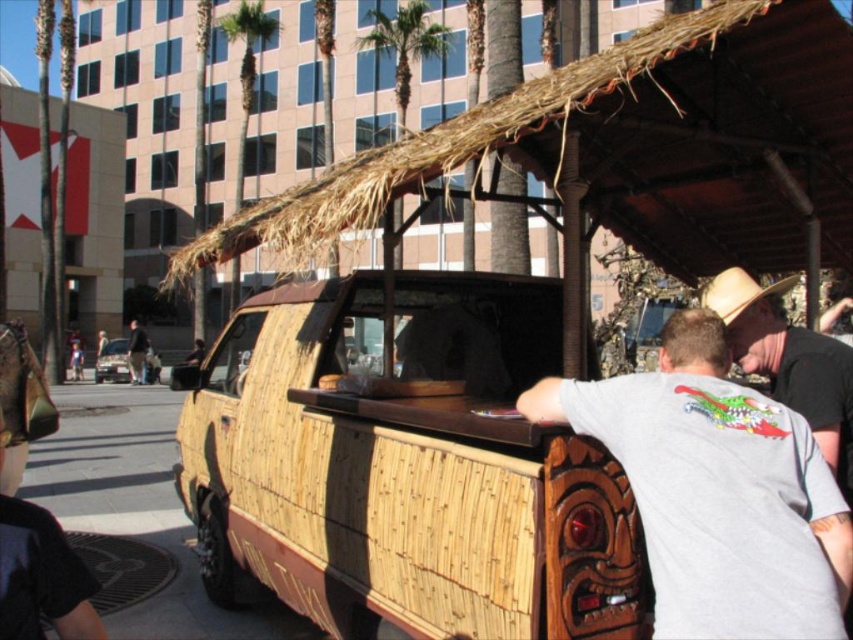
You are standing in front of the bamboo van at center and want to greet the person wearing the dark gray shirt at center. Which direction should you move to face them?

You should move to your left because the bamboo van at center is to the right of the dark gray shirt at center, meaning the shirt is to your left relative to the van.

You are standing at the origin point of the coordinate system in front of the van. The coordinate system has its origin at the bottom left corner of the image. The x and y axes increase to the right and upwards respectively. The counter is located at the front of the van. Where is the light brown straw cowboy hat at upper right relative to the counter? Please answer with coordinates.

The light brown straw cowboy hat at upper right is located at coordinates point (738, 292), which is above and to the right of the counter at the front of the van.